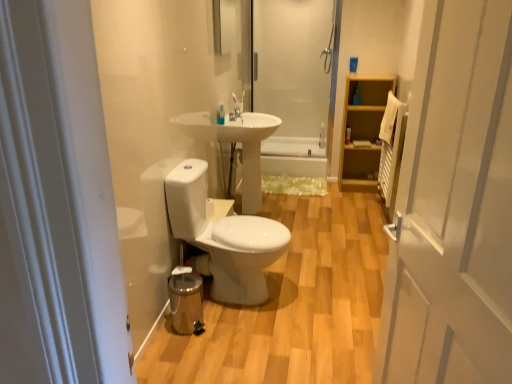
Identify the location of unoccupied region to the right of white glossy sink at center. Image resolution: width=512 pixels, height=384 pixels. (307, 208).